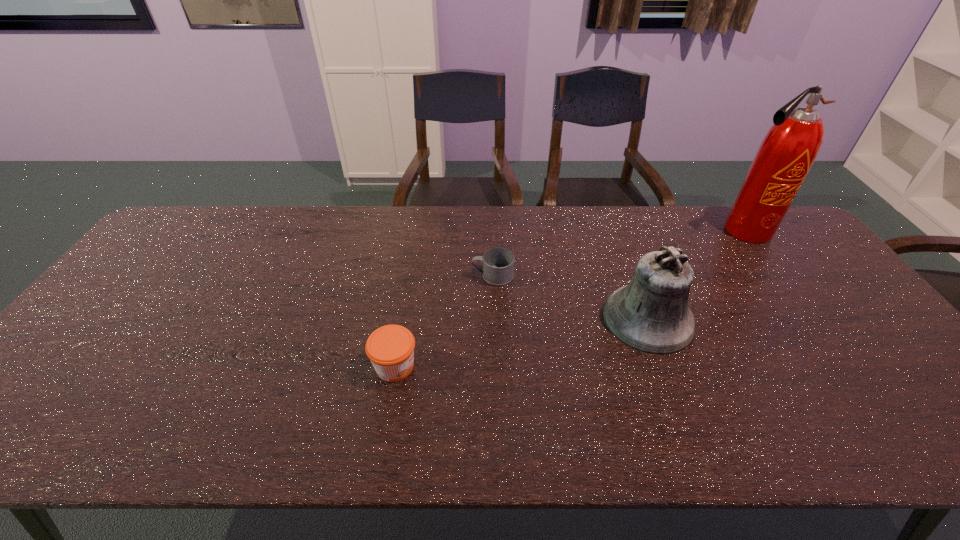
The width and height of the screenshot is (960, 540). What are the coordinates of `fire extinguisher` in the screenshot? It's located at (789, 149).

The width and height of the screenshot is (960, 540). What are the coordinates of `the rightmost object` in the screenshot? It's located at (789, 149).

Locate an element on the screen. the third shortest object is located at coordinates (651, 314).

The image size is (960, 540). I want to click on the second object from right to left, so click(651, 314).

Locate an element on the screen. The image size is (960, 540). jam is located at coordinates (390, 348).

Image resolution: width=960 pixels, height=540 pixels. I want to click on the second shortest object, so click(390, 348).

The height and width of the screenshot is (540, 960). What are the coordinates of `mug` in the screenshot? It's located at (498, 263).

I want to click on the second farthest object, so click(498, 263).

Image resolution: width=960 pixels, height=540 pixels. In order to click on free space located 0.180m on the left of the rightmost object in this screenshot , I will do `click(660, 231)`.

What are the coordinates of `vacant space located on the left of the third shortest object` in the screenshot? It's located at (510, 319).